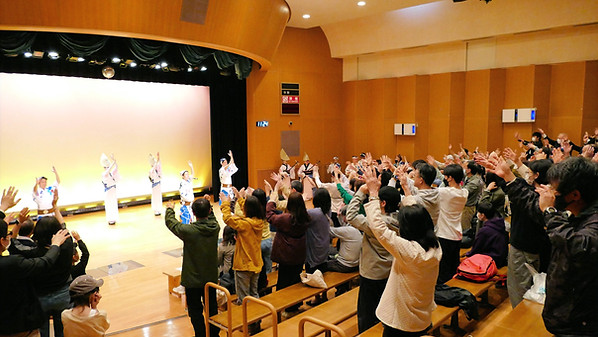
The height and width of the screenshot is (337, 598). In order to click on bench in this screenshot , I will do `click(267, 299)`.